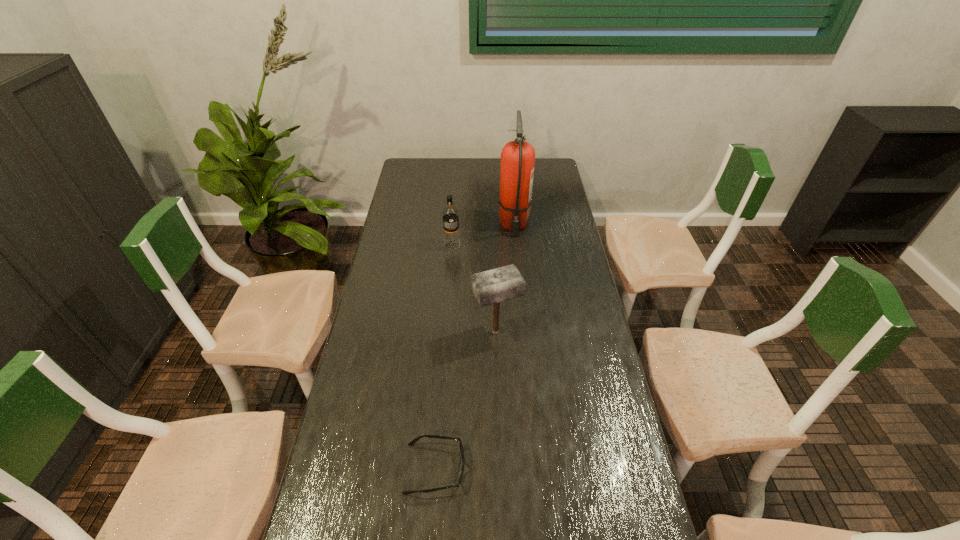
Locate an element on the screen. The width and height of the screenshot is (960, 540). free space that satisfies the following two spatial constraints: 1. on the label of the third farthest object; 2. on the left side of the vodka is located at coordinates (445, 332).

I want to click on free space that satisfies the following two spatial constraints: 1. on the front side of the second tallest object; 2. on the front-facing side of the shortest object, so click(501, 469).

Locate an element on the screen. This screenshot has height=540, width=960. vacant area that satisfies the following two spatial constraints: 1. on the label of the vodka; 2. on the front-facing side of the nearest object is located at coordinates (436, 469).

You are a GUI agent. You are given a task and a screenshot of the screen. Output one action in this format:
    pyautogui.click(x=<x>, y=<y>)
    Task: Click on the vacant space that satisfies the following two spatial constraints: 1. on the nozzle of the fire extinguisher; 2. on the front-facing side of the nearest object
    The height and width of the screenshot is (540, 960).
    Given the screenshot: What is the action you would take?
    pyautogui.click(x=537, y=469)